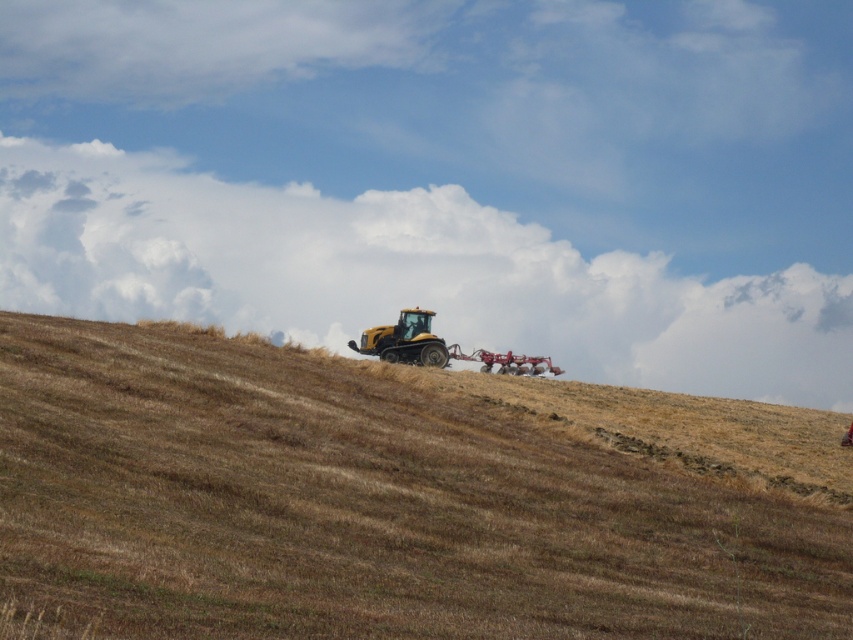
Is brown grassy hillside at center to the left of yellow matte tractor at center from the viewer's perspective?

In fact, brown grassy hillside at center is to the right of yellow matte tractor at center.

Can you confirm if brown grassy hillside at center is wider than yellow matte tractor at center?

Yes.

Between point (229, 566) and point (421, 342), which one is positioned in front?

Point (229, 566)

The height and width of the screenshot is (640, 853). Find the location of `brown grassy hillside at center`. brown grassy hillside at center is located at coordinates (397, 499).